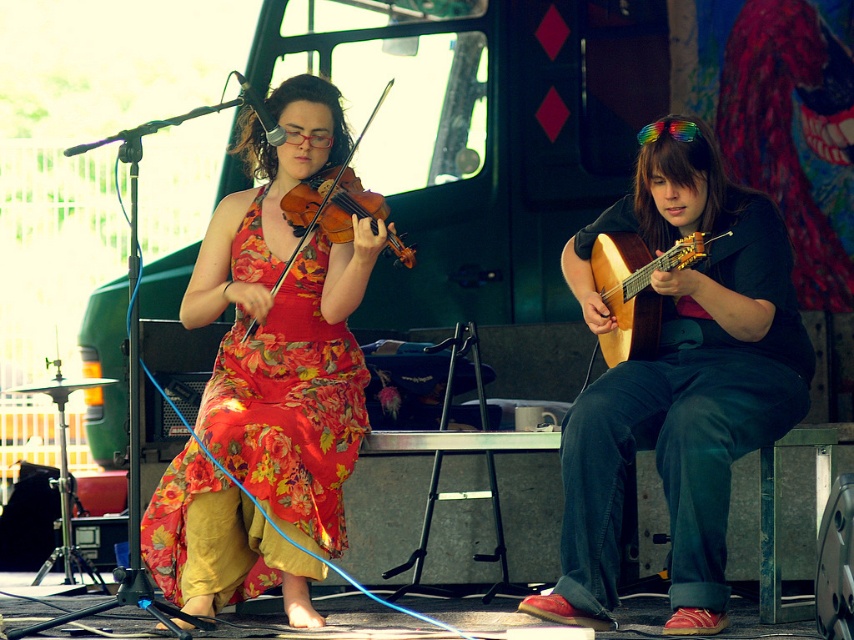
You are a photographer at a music event. You need to capture a photo where both the floral fabric dress at center and the wooden acoustic guitar at right are visible. Based on their positions, which object should you place on the left side of your photo frame?

The floral fabric dress at center is to the left of the wooden acoustic guitar at right, so you should place the floral fabric dress at center on the left side of your photo frame to include both in the shot.

You are a photographer at the live music performance and want to capture a closeup of the instruments. Which instrument, the matte black guitar at center or the matte wood violin at center, is positioned closer to the front of the stage?

The matte black guitar at center is closer to the viewer than the matte wood violin at center, so the matte black guitar at center is positioned closer to the front of the stage.